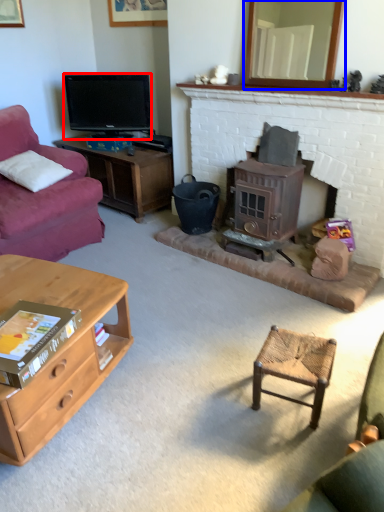
Question: Among these objects, which one is nearest to the camera, television (highlighted by a red box) or mirror (highlighted by a blue box)?

Choices:
 (A) television
 (B) mirror

Answer: (B)